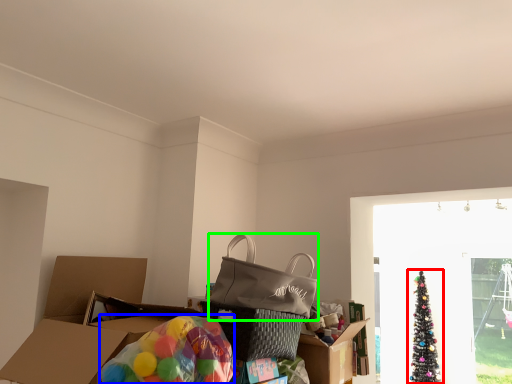
Question: Based on their relative distances, which object is nearer to christmas tree (highlighted by a red box)? Choose from balloon (highlighted by a blue box) and pack (highlighted by a green box).

Choices:
 (A) balloon
 (B) pack

Answer: (B)